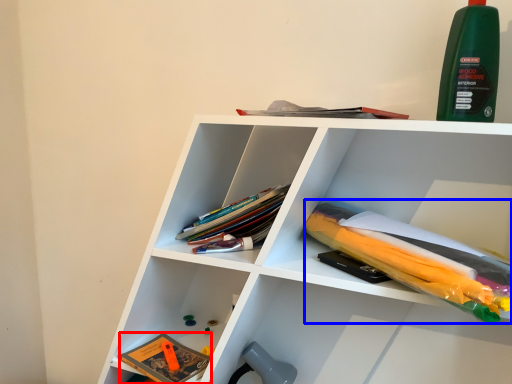
Question: Which of the following is the closest to the observer, book (highlighted by a red box) or book (highlighted by a blue box)?

Choices:
 (A) book
 (B) book

Answer: (B)